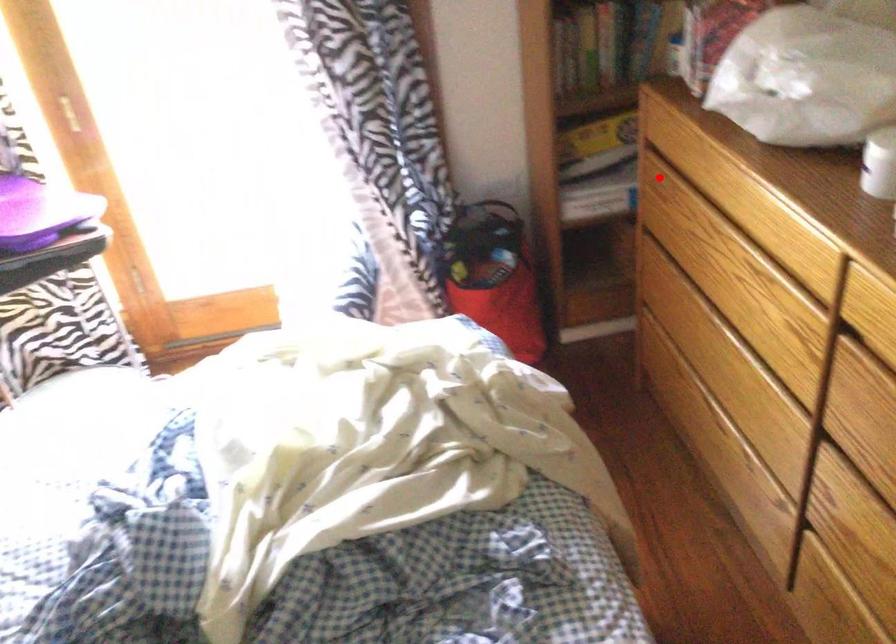
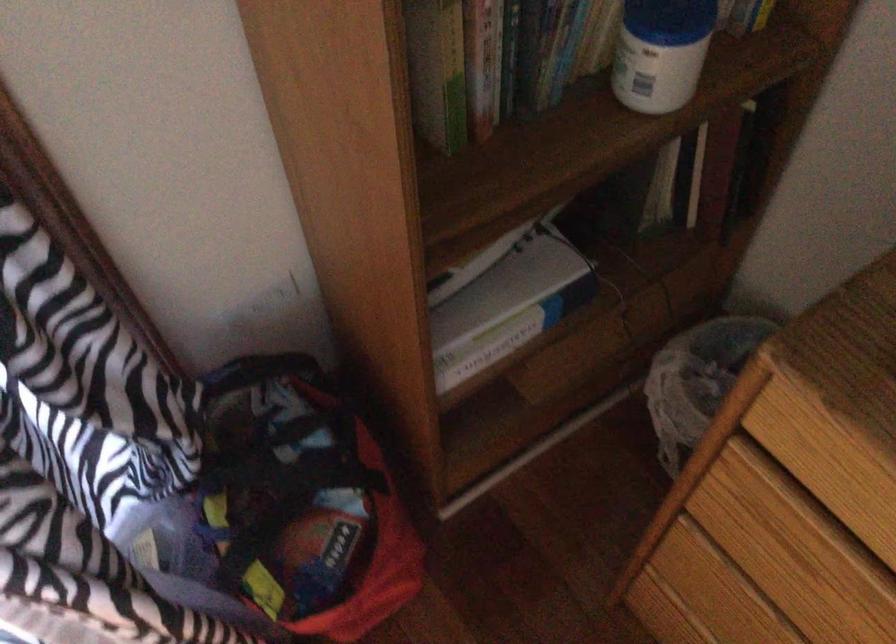
Question: I am providing you with two images of the same scene from different viewpoints. In image1, a red point is highlighted. Considering the same 3D point in image2, which of the following is correct?

Choices:
 (A) It is closer
 (B) It is farther

Answer: (A)